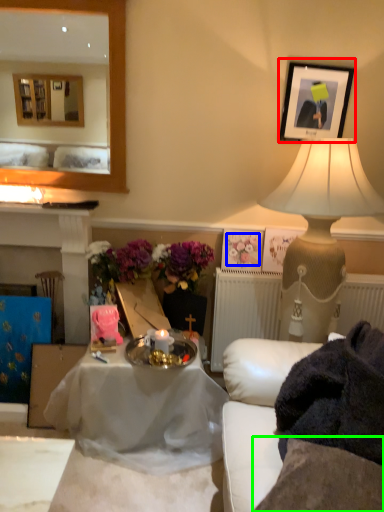
Question: Which object is the closest to the picture frame (highlighted by a red box)? Choose among these: flower (highlighted by a blue box) or sheet (highlighted by a green box).

Choices:
 (A) flower
 (B) sheet

Answer: (A)